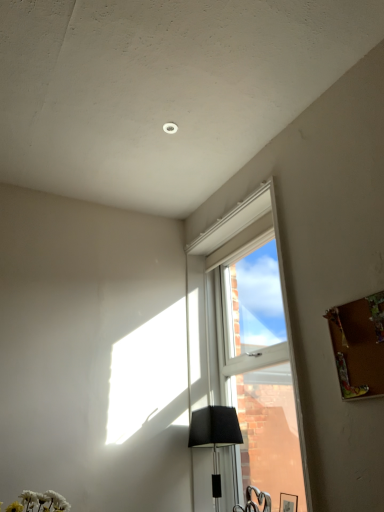
Question: In terms of width, does clear glass window at center look wider or thinner when compared to matte black lampshade at lower center?

Choices:
 (A) thin
 (B) wide

Answer: (A)

Question: Considering the positions of clear glass window at center and matte black lampshade at lower center in the image, is clear glass window at center taller or shorter than matte black lampshade at lower center?

Choices:
 (A) short
 (B) tall

Answer: (B)

Question: Considering the positions of point (276, 327) and point (218, 478), is point (276, 327) closer or farther from the camera than point (218, 478)?

Choices:
 (A) farther
 (B) closer

Answer: (B)

Question: From the image's perspective, is matte black lampshade at lower center located above or below clear glass window at center?

Choices:
 (A) below
 (B) above

Answer: (A)

Question: Considering the positions of matte black lampshade at lower center and clear glass window at center in the image, is matte black lampshade at lower center taller or shorter than clear glass window at center?

Choices:
 (A) tall
 (B) short

Answer: (B)

Question: Is matte black lampshade at lower center to the left or to the right of clear glass window at center in the image?

Choices:
 (A) left
 (B) right

Answer: (A)

Question: Considering their positions, is matte black lampshade at lower center located in front of or behind clear glass window at center?

Choices:
 (A) front
 (B) behind

Answer: (B)